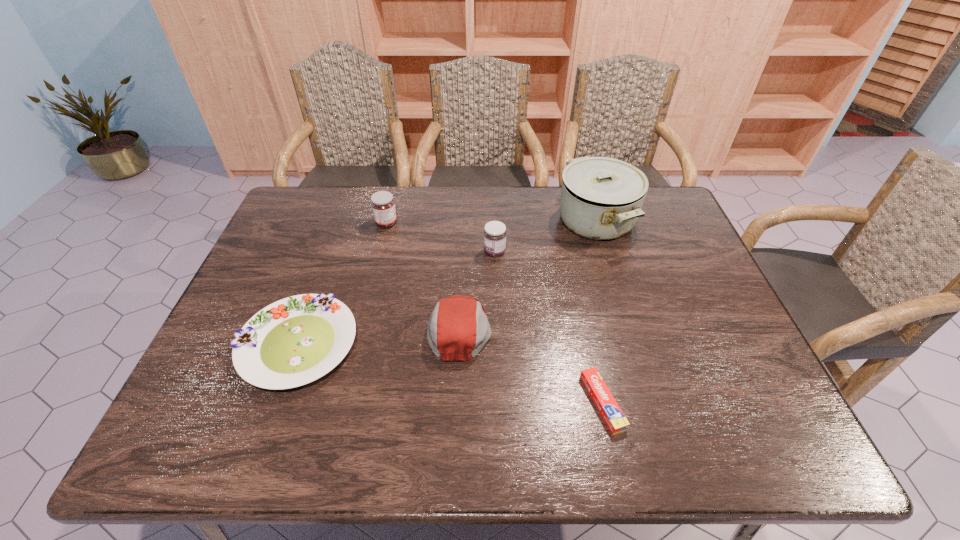
Find the location of a particular element. vacant space that satisfies the following two spatial constraints: 1. on the front-facing side of the cap; 2. on the back side of the toothpaste is located at coordinates (457, 402).

This screenshot has height=540, width=960. Identify the location of free location that satisfies the following two spatial constraints: 1. on the back side of the toothpaste; 2. on the front label of the nearer jam. (570, 252).

Where is `vacant space that satisfies the following two spatial constraints: 1. on the front label of the nearer jam; 2. on the right side of the toothpaste`? This screenshot has height=540, width=960. vacant space that satisfies the following two spatial constraints: 1. on the front label of the nearer jam; 2. on the right side of the toothpaste is located at coordinates (500, 402).

At what (x,y) coordinates should I click in order to perform the action: click on free space that satisfies the following two spatial constraints: 1. on the front label of the nearer jam; 2. on the left side of the toothpaste. Please return your answer as a coordinate pair (x, y). Image resolution: width=960 pixels, height=540 pixels. Looking at the image, I should click on (500, 402).